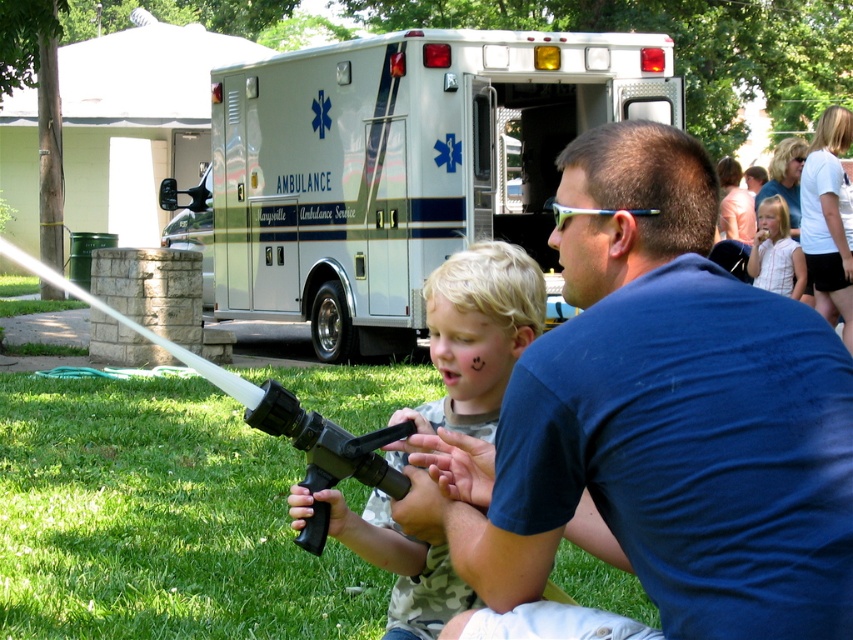
Question: Which object appears closest to the camera in this image?

Choices:
 (A) black plastic hose at lower center
 (B) white glossy ambulance at center
 (C) blue cotton shirt at center
 (D) camouflage-patterned shirt at center

Answer: (C)

Question: Which is farther from the blue cotton shirt at center?

Choices:
 (A) camouflage-patterned shirt at center
 (B) white striped shirt at upper right

Answer: (B)

Question: Can you confirm if blue cotton shirt at center is smaller than camouflage-patterned shirt at center?

Choices:
 (A) no
 (B) yes

Answer: (A)

Question: Is white glossy ambulance at center above white striped shirt at upper right?

Choices:
 (A) yes
 (B) no

Answer: (A)

Question: Can you confirm if blue cotton shirt at center is positioned below camouflage-patterned shirt at center?

Choices:
 (A) no
 (B) yes

Answer: (A)

Question: Which of the following is the farthest from the observer?

Choices:
 (A) blue cotton shirt at center
 (B) camouflage-patterned shirt at center

Answer: (B)